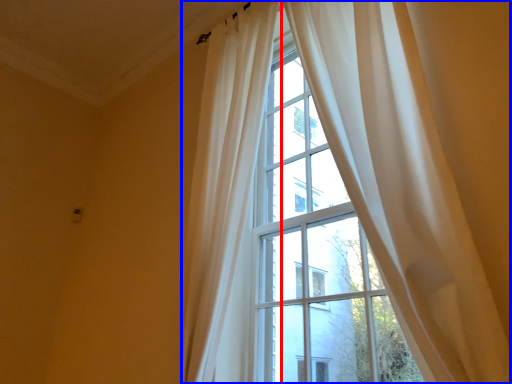
Question: Which object appears farthest to the camera in this image, curtain (highlighted by a red box) or curtain (highlighted by a blue box)?

Choices:
 (A) curtain
 (B) curtain

Answer: (A)